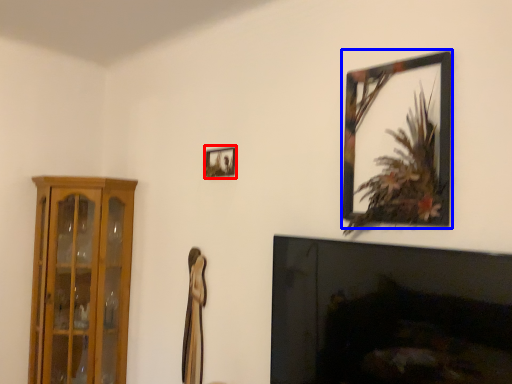
Question: Which object appears closest to the camera in this image, picture frame (highlighted by a red box) or picture frame (highlighted by a blue box)?

Choices:
 (A) picture frame
 (B) picture frame

Answer: (B)